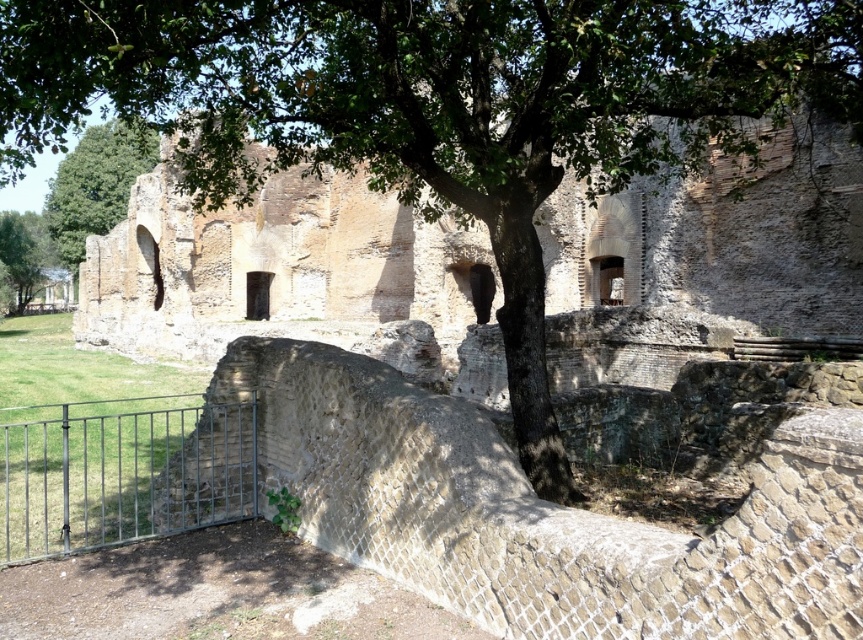
Consider the image. Can you confirm if metallic gate at lower left is positioned above green leafy tree at lower left?

No.

What do you see at coordinates (121, 472) in the screenshot? I see `metallic gate at lower left` at bounding box center [121, 472].

The width and height of the screenshot is (863, 640). In order to click on metallic gate at lower left in this screenshot , I will do `click(121, 472)`.

Is metallic gate at lower left smaller than green leafy tree at upper left?

Yes.

Can you confirm if metallic gate at lower left is positioned above green leafy tree at upper left?

No, metallic gate at lower left is not above green leafy tree at upper left.

Is point (29, 515) positioned after point (73, 266)?

No, (29, 515) is closer to viewer.

This screenshot has height=640, width=863. I want to click on metallic gate at lower left, so click(x=121, y=472).

Does green leafy tree at upper left have a greater width compared to green leafy tree at lower left?

Indeed, green leafy tree at upper left has a greater width compared to green leafy tree at lower left.

Does green leafy tree at upper left have a smaller size compared to green leafy tree at lower left?

No, green leafy tree at upper left is not smaller than green leafy tree at lower left.

This screenshot has height=640, width=863. Find the location of `green leafy tree at upper left`. green leafy tree at upper left is located at coordinates (96, 184).